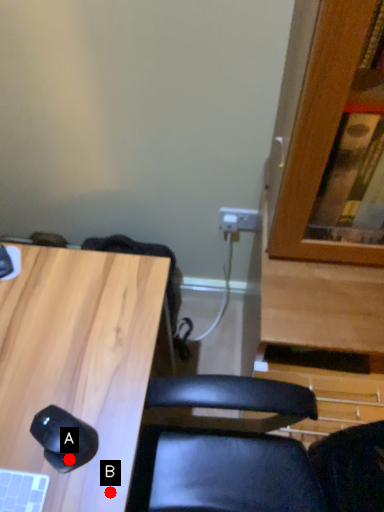
Question: Two points are circled on the image, labeled by A and B beside each circle. Among these points, which one is farthest from the camera?

Choices:
 (A) A is further
 (B) B is further

Answer: (A)